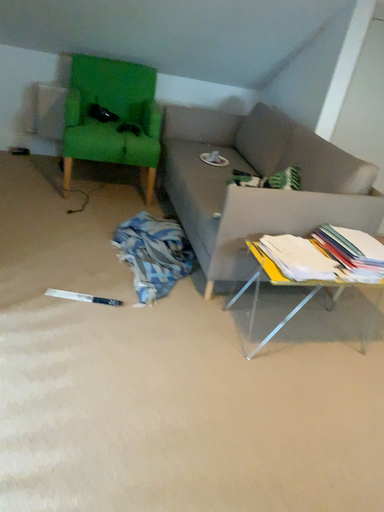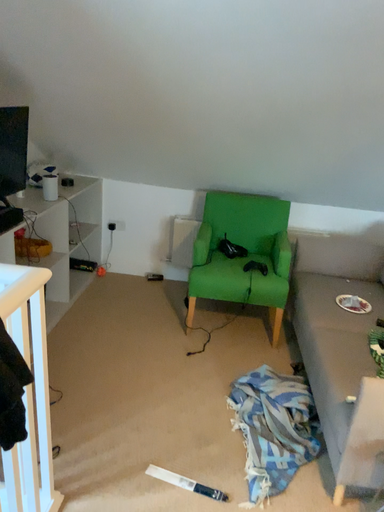
Question: How did the camera likely rotate when shooting the video?

Choices:
 (A) rotated upward
 (B) rotated downward

Answer: (A)